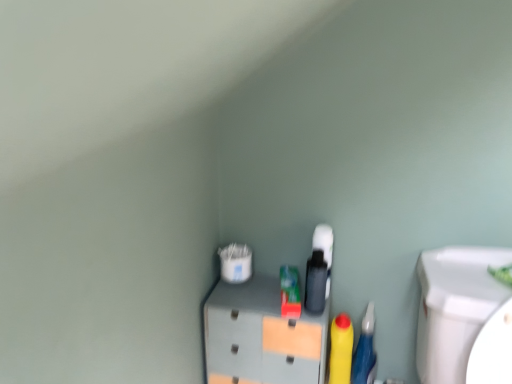
Question: Is yellow matte bottle at center located outside rubberized blue pen at right?

Choices:
 (A) no
 (B) yes

Answer: (B)

Question: Does yellow matte bottle at center have a greater width compared to rubberized blue pen at right?

Choices:
 (A) no
 (B) yes

Answer: (A)

Question: Is yellow matte bottle at center thinner than rubberized blue pen at right?

Choices:
 (A) no
 (B) yes

Answer: (B)

Question: Could you tell me if yellow matte bottle at center is turned towards rubberized blue pen at right?

Choices:
 (A) no
 (B) yes

Answer: (A)

Question: Is rubberized blue pen at right completely or partially inside yellow matte bottle at center?

Choices:
 (A) yes
 (B) no

Answer: (B)

Question: From a real-world perspective, is yellow matte bottle at center on top of rubberized blue pen at right?

Choices:
 (A) yes
 (B) no

Answer: (A)

Question: Does matte gray cabinet at center have a greater height compared to rubberized blue pen at right?

Choices:
 (A) yes
 (B) no

Answer: (A)

Question: From the image's perspective, would you say matte gray cabinet at center is shown under rubberized blue pen at right?

Choices:
 (A) yes
 (B) no

Answer: (B)

Question: From a real-world perspective, is matte gray cabinet at center beneath rubberized blue pen at right?

Choices:
 (A) yes
 (B) no

Answer: (B)

Question: Does matte gray cabinet at center come in front of rubberized blue pen at right?

Choices:
 (A) no
 (B) yes

Answer: (B)

Question: Does matte gray cabinet at center appear on the left side of rubberized blue pen at right?

Choices:
 (A) yes
 (B) no

Answer: (A)

Question: Considering the relative sizes of matte gray cabinet at center and rubberized blue pen at right in the image provided, is matte gray cabinet at center smaller than rubberized blue pen at right?

Choices:
 (A) no
 (B) yes

Answer: (A)

Question: Does yellow matte bottle at center appear on the right side of matte gray cabinet at center?

Choices:
 (A) yes
 (B) no

Answer: (A)